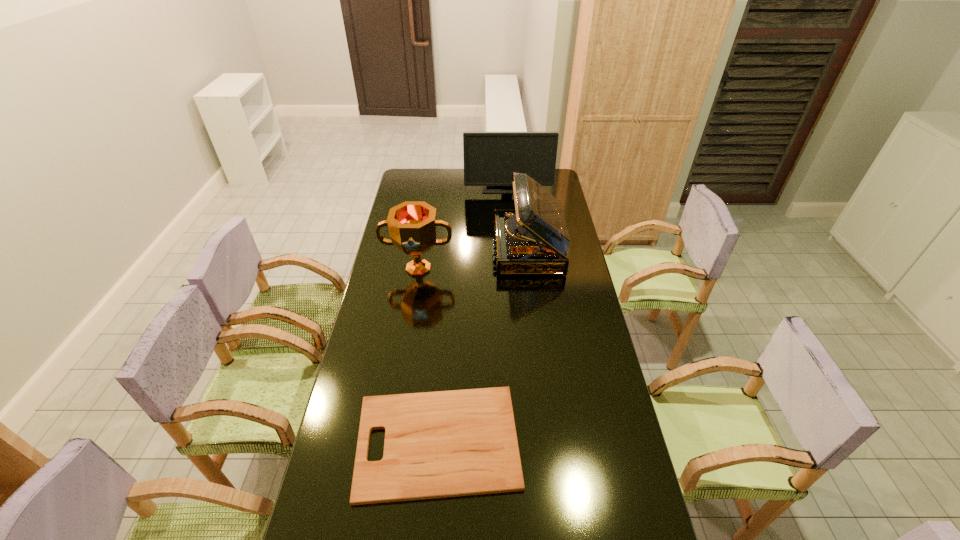
The image size is (960, 540). Identify the location of free space located 0.260m on the back of the shortest object. (446, 329).

At what (x,y) coordinates should I click in order to perform the action: click on object present at the far edge. Please return your answer as a coordinate pair (x, y). The image size is (960, 540). Looking at the image, I should click on (490, 158).

Image resolution: width=960 pixels, height=540 pixels. What are the coordinates of `award at the left edge` in the screenshot? It's located at pyautogui.click(x=412, y=225).

Identify the location of chopping board that is at the left edge. The height and width of the screenshot is (540, 960). (440, 444).

Identify the location of computer monitor located at the right edge. The height and width of the screenshot is (540, 960). (490, 158).

Locate an element on the screen. This screenshot has width=960, height=540. record player that is at the right edge is located at coordinates (533, 239).

In order to click on object that is at the far right corner in this screenshot , I will do `click(490, 158)`.

This screenshot has width=960, height=540. I want to click on vacant space at the far edge of the desktop, so click(x=437, y=185).

Identify the location of free space at the left edge of the desktop. Image resolution: width=960 pixels, height=540 pixels. 382,267.

Locate an element on the screen. This screenshot has width=960, height=540. vacant space at the right edge of the desktop is located at coordinates (576, 341).